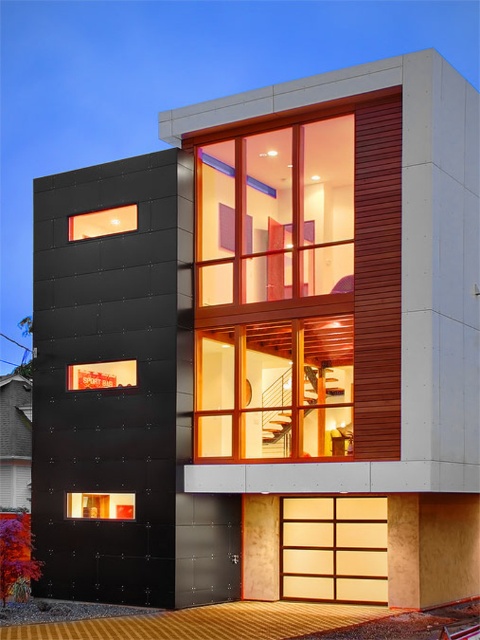
Question: Based on their relative distances, which object is farther from the matte black window at lower left?

Choices:
 (A) light beige wood garage door at lower center
 (B) matte glass window at center

Answer: (B)

Question: Which object is farther from the camera taking this photo?

Choices:
 (A) matte glass window at center
 (B) light beige wood garage door at lower center
 (C) matte black window at lower left

Answer: (C)

Question: Is matte glass window at center above matte black window at lower left?

Choices:
 (A) yes
 (B) no

Answer: (A)

Question: Is matte glass window at center below matte black window at upper left?

Choices:
 (A) yes
 (B) no

Answer: (A)

Question: From the image, what is the correct spatial relationship of matte black window at upper left in relation to matte black window at lower left?

Choices:
 (A) right
 (B) left

Answer: (B)

Question: Which object is positioned closest to the matte black window at lower left?

Choices:
 (A) light beige wood garage door at lower center
 (B) matte glass window at center

Answer: (A)